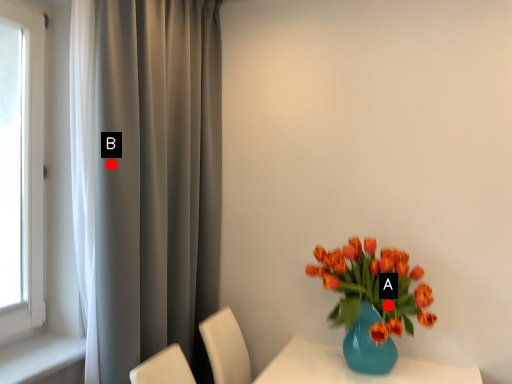
Question: Two points are circled on the image, labeled by A and B beside each circle. Among these points, which one is farthest from the camera?

Choices:
 (A) A is further
 (B) B is further

Answer: (A)